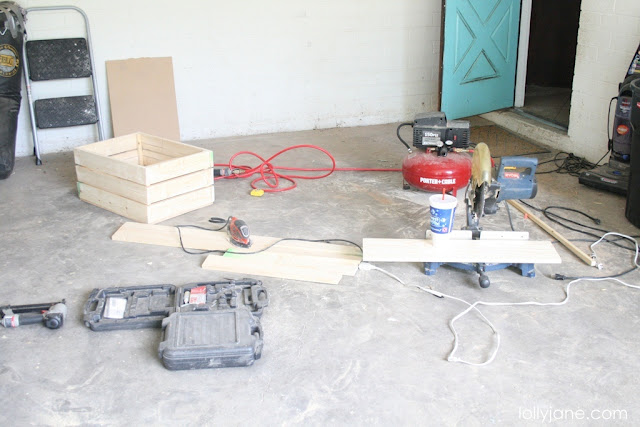
You are a GUI agent. You are given a task and a screenshot of the screen. Output one action in this format:
    pyautogui.click(x=<x>, y=<y>)
    Task: Click on the vacuum cleaner
    
    Given the screenshot: What is the action you would take?
    pyautogui.click(x=620, y=138)